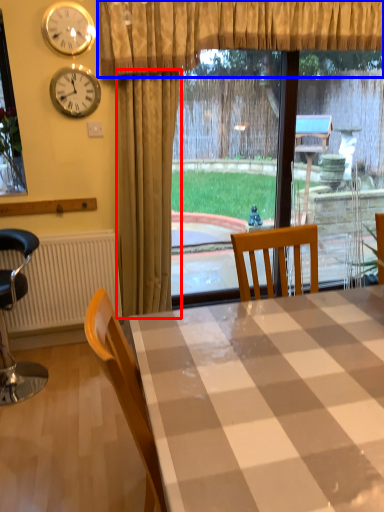
Question: Which object is further to the camera taking this photo, curtain (highlighted by a red box) or curtain (highlighted by a blue box)?

Choices:
 (A) curtain
 (B) curtain

Answer: (A)